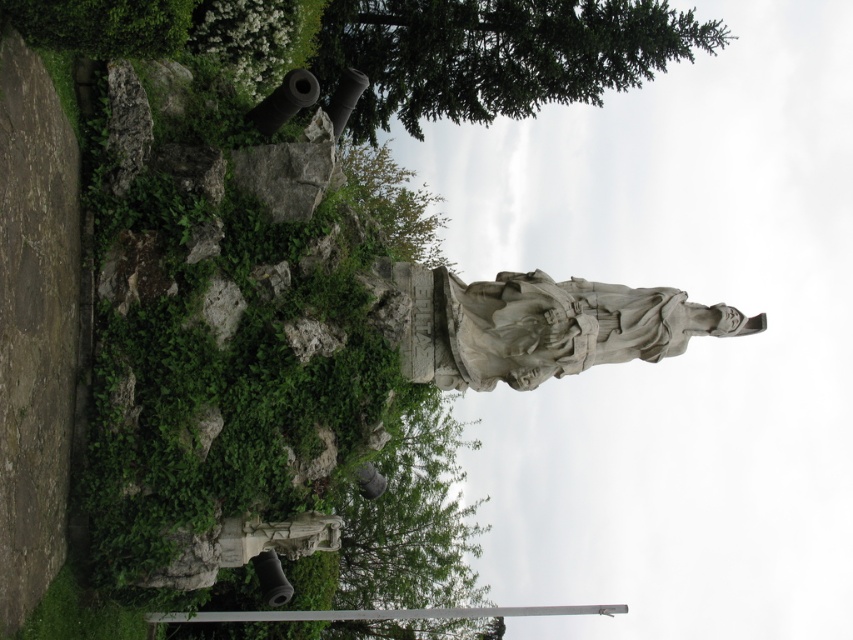
You are a photographer wanting to capture the white stone statue at center without any obstruction from the green leafy tree at upper center. Based on their positions, is this possible?

The white stone statue at center is behind the green leafy tree at upper center, so it would be obstructed by the tree. To capture an unobstructed view, you would need to adjust your position or angle to avoid the tree.

You are a landscape architect designing a new park. You want to ensure that the white stone statue at center is visible from a distance. Considering the green leafy tree at upper center, will its size affect the visibility of the statue?

The green leafy tree at upper center is larger than the white stone statue at center, so it may obstruct the view of the statue from certain angles or distances, depending on their placement.

You are an architect designing a new park layout and want to place a new bench exactly at the coordinates where the green leafy tree at upper center is located. What are the coordinates you should use?

The coordinates for the green leafy tree at upper center are 0.086 in the x direction and 0.581 in the y direction.